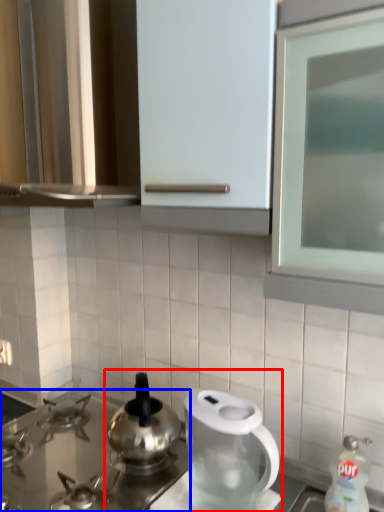
Question: Which object appears farthest to the camera in this image, tea set (highlighted by a red box) or gas stove (highlighted by a blue box)?

Choices:
 (A) tea set
 (B) gas stove

Answer: (B)